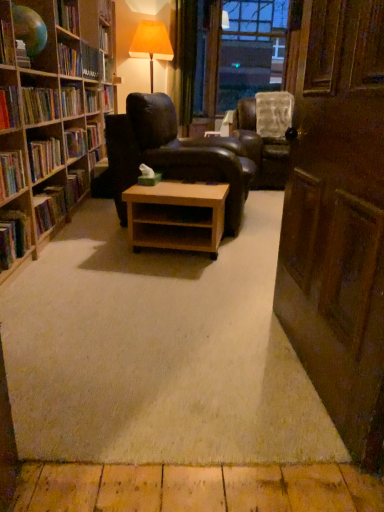
Find the location of a particular element. hardcover book at upper left, the 6th book ordered from the bottom is located at coordinates (80, 61).

In order to face light brown wood at center, should I rotate leftwards or rightwards?

Rotate left and turn 1.802 degrees.

Describe the element at coordinates (11, 173) in the screenshot. I see `hardcover book at left, the 1th book in the front-to-back sequence` at that location.

Consider the image. Measure the distance between hardcover book at left, positioned as the fifth book in back-to-front order, and camera.

hardcover book at left, positioned as the fifth book in back-to-front order, and camera are 2.13 meters apart from each other.

In the scene shown: What is the approximate width of leather armchair at center, which is counted as the 1th chair, starting from the back?

1.06 meters.

What do you see at coordinates (39, 105) in the screenshot?
I see `hardcover book at left, the third book from the top` at bounding box center [39, 105].

The image size is (384, 512). What are the coordinates of `hardcover book at upper left, placed as the second book when sorted from back to front` in the screenshot? It's located at (80, 61).

Is hardcover book at upper left, positioned as the second book in top-to-bottom order, surrounding hardcover book at upper left, the 1th book when ordered from top to bottom?

No.

Is hardcover book at upper left, marked as the fifth book in a bottom-to-top arrangement, positioned with its back to hardcover book at upper left, the 1th book when ordered from top to bottom?

That's not correct — hardcover book at upper left, marked as the fifth book in a bottom-to-top arrangement, is not looking away from hardcover book at upper left, the 1th book when ordered from top to bottom.

From a real-world perspective, which object rests below the other?

hardcover book at upper left, the sixth book in the front-to-back sequence, from a real-world perspective.

Considering the relative sizes of hardcover book at upper left, marked as the fifth book in a bottom-to-top arrangement, and hardcover book at upper left, the 6th book ordered from the bottom, in the image provided, is hardcover book at upper left, marked as the fifth book in a bottom-to-top arrangement, wider than hardcover book at upper left, the 6th book ordered from the bottom,?

Yes.

Image resolution: width=384 pixels, height=512 pixels. There is a wooden door at right. In order to click on the 1st book above it (from a real-world perspective) in this screenshot , I will do click(39, 105).

Is hardcover book at left, which is counted as the 4th book, starting from the back, touching wooden door at right?

hardcover book at left, which is counted as the 4th book, starting from the back, and wooden door at right are not in contact.

Which object is closer to the camera taking this photo, hardcover book at left, the fourth book when ordered from bottom to top, or wooden door at right?

wooden door at right is more forward.

In terms of height, does light brown wood at center look taller or shorter compared to leather armchair at center, the 2th chair when ordered from back to front?

Considering their sizes, light brown wood at center has less height than leather armchair at center, the 2th chair when ordered from back to front.

Is light brown wood at center positioned far away from leather armchair at center, acting as the second chair starting from the right?

No, light brown wood at center is not far from leather armchair at center, acting as the second chair starting from the right.

Does light brown wood at center turn towards leather armchair at center, the 2th chair when ordered from back to front?

No, light brown wood at center does not turn towards leather armchair at center, the 2th chair when ordered from back to front.

From a real-world perspective, does light brown wood at center stand above leather armchair at center, which ranks as the 1th chair in front-to-back order?

No.

Looking at this image, could you measure the distance between light brown wood at center and hardcover book at left, marked as the fifth book in a top-to-bottom arrangement?

30.06 inches.

Is light brown wood at center far away from hardcover book at left, marked as the fifth book in a top-to-bottom arrangement?

light brown wood at center is near hardcover book at left, marked as the fifth book in a top-to-bottom arrangement, not far away.

Is point (156, 207) farther from viewer compared to point (53, 198)?

No.

Considering the relative sizes of light brown wood at center and hardcover book at left, which is the fourth book in front-to-back order, in the image provided, is light brown wood at center smaller than hardcover book at left, which is the fourth book in front-to-back order,?

Incorrect, light brown wood at center is not smaller in size than hardcover book at left, which is the fourth book in front-to-back order.

From a real-world perspective, is hardcover book at left, the third book from the top, physically below hardcover book at left, which is the fourth book in front-to-back order?

No, from a real-world perspective, hardcover book at left, the third book from the top, is not below hardcover book at left, which is the fourth book in front-to-back order.

From the image's perspective, is hardcover book at left, which is counted as the 4th book, starting from the back, over hardcover book at left, which is the fourth book in front-to-back order?

Yes.

Does hardcover book at left, the fourth book when ordered from bottom to top, touch hardcover book at left, which is the fourth book in front-to-back order?

No, hardcover book at left, the fourth book when ordered from bottom to top, is not next to hardcover book at left, which is the fourth book in front-to-back order.

Between hardcover book at left, the third book from the top, and hardcover book at left, acting as the 3th book starting from the back, which one has larger width?

hardcover book at left, the third book from the top, is wider.

From a real-world perspective, between leather armchair at center, which ranks as the 1th chair in front-to-back order, and transparent plastic window screen at upper center, who is vertically lower?

From a 3D spatial view, leather armchair at center, which ranks as the 1th chair in front-to-back order, is below.

Considering the sizes of leather armchair at center, which ranks as the 1th chair in front-to-back order, and transparent plastic window screen at upper center in the image, is leather armchair at center, which ranks as the 1th chair in front-to-back order, bigger or smaller than transparent plastic window screen at upper center?

leather armchair at center, which ranks as the 1th chair in front-to-back order, is smaller than transparent plastic window screen at upper center.

Is leather armchair at center, acting as the second chair starting from the right, to the left or to the right of transparent plastic window screen at upper center in the image?

From the image, it's evident that leather armchair at center, acting as the second chair starting from the right, is to the left of transparent plastic window screen at upper center.

What's the angular difference between leather armchair at center, which ranks as the 1th chair in front-to-back order, and transparent plastic window screen at upper center's facing directions?

The angular difference between leather armchair at center, which ranks as the 1th chair in front-to-back order, and transparent plastic window screen at upper center is 76 degrees.

Is hardcover book at left, marked as the fifth book in a top-to-bottom arrangement, taller than wooden door at right?

Incorrect, the height of hardcover book at left, marked as the fifth book in a top-to-bottom arrangement, is not larger of that of wooden door at right.

From the image's perspective, which one is positioned lower, hardcover book at left, marked as the fifth book in a top-to-bottom arrangement, or wooden door at right?

wooden door at right.

Is hardcover book at left, placed as the second book when sorted from bottom to top, oriented towards wooden door at right?

No, hardcover book at left, placed as the second book when sorted from bottom to top, does not turn towards wooden door at right.

Locate an element on the screen. the 1st book in front of the hardcover book at upper left, positioned as the second book in top-to-bottom order, starting your count from the anchor is located at coordinates (80, 61).

Identify the location of door to the right of hardcover book at left, the fourth book when ordered from bottom to top. (338, 219).

Looking at the image, which one is located further to transparent plastic window screen at upper center, light brown wood at center or matte black globe at upper left?

light brown wood at center is positioned further to the anchor transparent plastic window screen at upper center.

Which object lies nearer to the anchor point hardcover book at left, the 1th book in the front-to-back sequence, hardcover book at upper left, placed as the second book when sorted from back to front, or hardcover book at left, placed as the second book when sorted from bottom to top?

hardcover book at left, placed as the second book when sorted from bottom to top.

When comparing their distances from leather armchair at center, the 2th chair when ordered from back to front, does hardcover book at upper left, the sixth book in the front-to-back sequence, or hardcover book at left, the 4th book when ordered from top to bottom, seem closer?

hardcover book at upper left, the sixth book in the front-to-back sequence, is positioned closer to the anchor leather armchair at center, the 2th chair when ordered from back to front.

When comparing their distances from hardcover book at left, the 4th book when ordered from top to bottom, does hardcover book at left, the third book from the top, or leather armchair at center, acting as the second chair starting from the right, seem closer?

Based on the image, hardcover book at left, the third book from the top, appears to be nearer to hardcover book at left, the 4th book when ordered from top to bottom.

Considering their positions, is leather armchair at center, which ranks as the first chair in right-to-left order, positioned further to transparent plastic window screen at upper center than hardcover book at upper left, marked as the fifth book in a front-to-back arrangement?

Based on the image, hardcover book at upper left, marked as the fifth book in a front-to-back arrangement, appears to be further to transparent plastic window screen at upper center.

Considering their positions, is wooden bookshelf at left positioned closer to wooden door at right than hardcover book at left, which is counted as the third book, starting from the bottom?

hardcover book at left, which is counted as the third book, starting from the bottom, is closer to wooden door at right.

Looking at the image, which one is located closer to wooden door at right, leather armchair at center, which ranks as the first chair in right-to-left order, or hardcover book at upper left, marked as the fifth book in a bottom-to-top arrangement?

leather armchair at center, which ranks as the first chair in right-to-left order, is positioned closer to the anchor wooden door at right.

Estimate the real-world distances between objects in this image. Which object is further from transparent plastic window screen at upper center, matte orange fabric lampshade at upper center or hardcover book at left, acting as the second book starting from the front?

Among the two, hardcover book at left, acting as the second book starting from the front, is located further to transparent plastic window screen at upper center.

Identify the location of shelf between wooden bookshelf at left and leather armchair at center, acting as the 1th chair starting from the left, along the z-axis. The width and height of the screenshot is (384, 512). (36, 32).

Identify the location of bookcase between wooden door at right and light brown wood at center in the front-back direction. (54, 119).

At what (x,y) coordinates should I click in order to perform the action: click on shelf between hardcover book at left, which is counted as the third book, starting from the bottom, and hardcover book at upper left, marked as the fifth book in a front-to-back arrangement, along the z-axis. Please return your answer as a coordinate pair (x, y). Looking at the image, I should click on (36, 32).

You are a GUI agent. You are given a task and a screenshot of the screen. Output one action in this format:
    pyautogui.click(x=<x>, y=<y>)
    Task: Click on the desk between wooden bookshelf at left and hardcover book at upper left, marked as the fifth book in a front-to-back arrangement, in the front-back direction
    
    Given the screenshot: What is the action you would take?
    pyautogui.click(x=176, y=216)